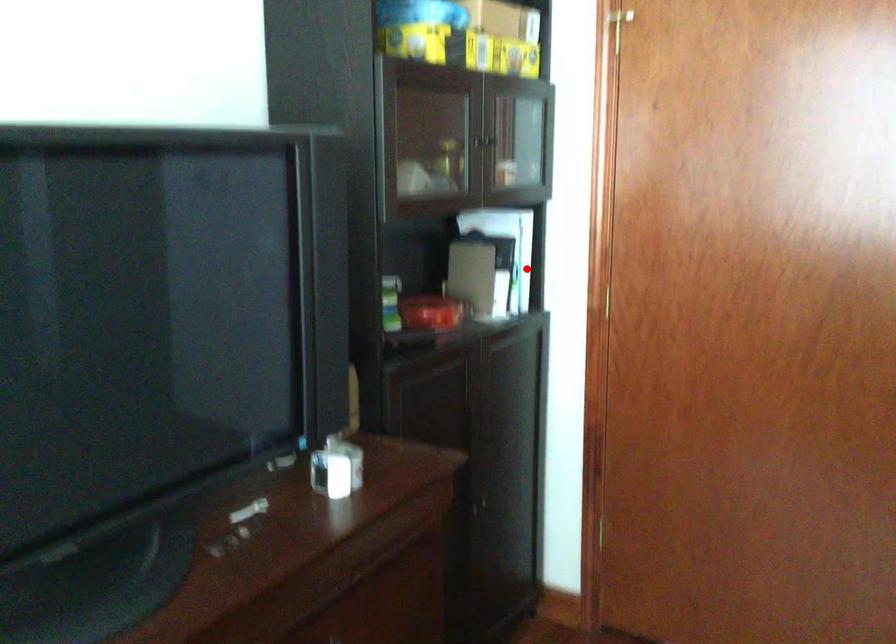
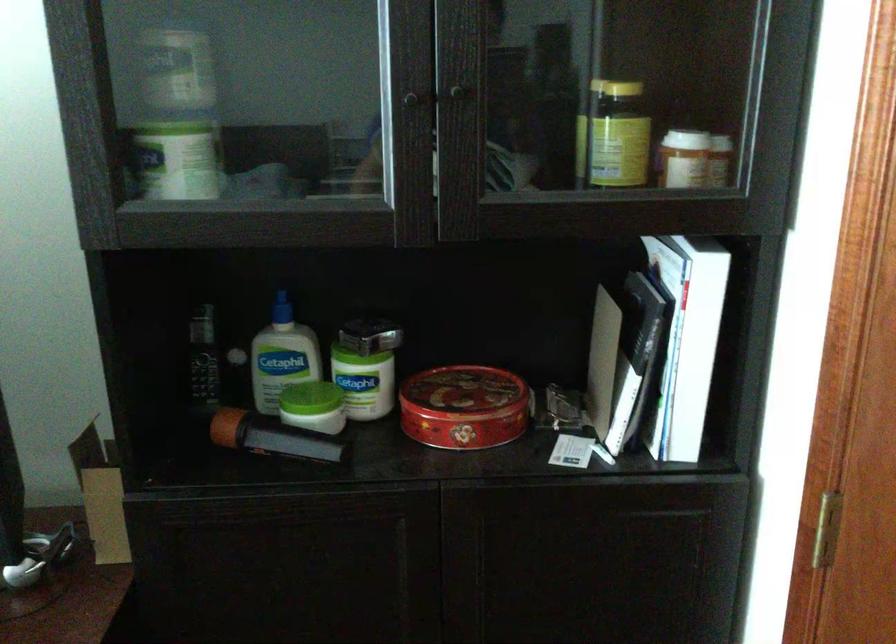
In the second image, find the point that corresponds to the highlighted location in the first image.

(728, 373)